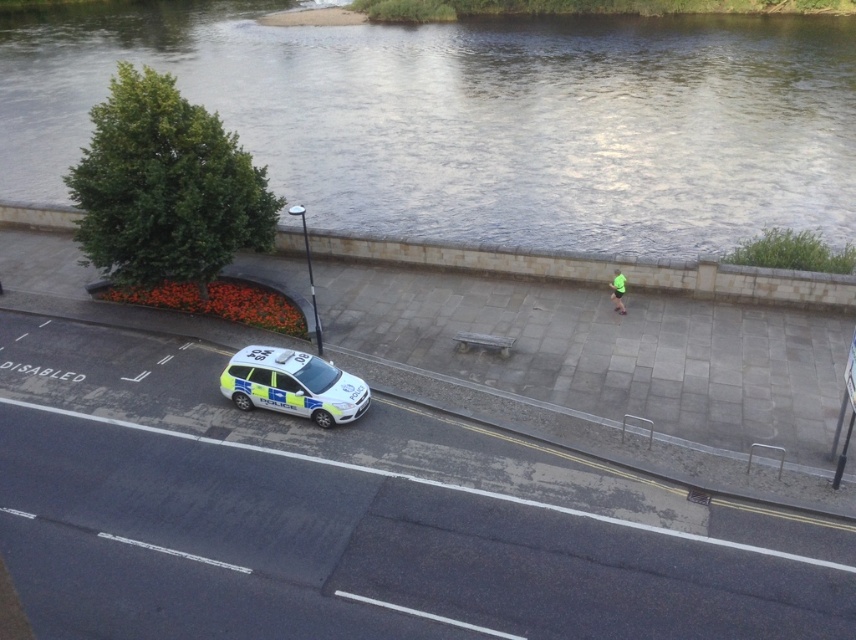
Which of these two, white glossy police car at center or green fabric shorts at center, stands shorter?

green fabric shorts at center is shorter.

Can you confirm if white glossy police car at center is thinner than green fabric shorts at center?

In fact, white glossy police car at center might be wider than green fabric shorts at center.

Between point (230, 394) and point (617, 310), which one is positioned in front?

Point (230, 394) is in front.

Where is `white glossy police car at center`? The height and width of the screenshot is (640, 856). white glossy police car at center is located at coordinates [x=293, y=385].

Which of these two, clear water at upper center or white glossy police car at center, stands shorter?

white glossy police car at center

This screenshot has width=856, height=640. Identify the location of clear water at upper center. (477, 118).

Who is more forward, (718,20) or (302,396)?

Positioned in front is point (302,396).

Where is `clear water at upper center`? clear water at upper center is located at coordinates (477, 118).

Is point (42, 106) farther from viewer compared to point (615, 300)?

Yes, it is behind point (615, 300).

Can you confirm if clear water at upper center is taller than green fabric shorts at center?

Yes, clear water at upper center is taller than green fabric shorts at center.

Who is more forward, [189,38] or [617,272]?

Positioned in front is point [617,272].

Where is `clear water at upper center`? This screenshot has width=856, height=640. clear water at upper center is located at coordinates (477, 118).